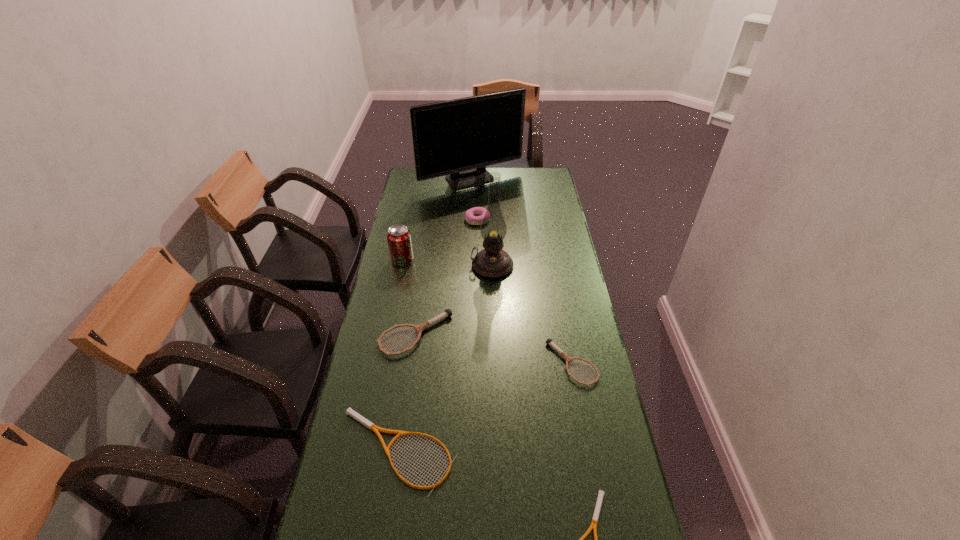
Locate an element on the screen. computer monitor is located at coordinates pos(458,138).

Find the location of a particular element. oil lamp is located at coordinates pos(492,262).

In order to click on soda can in this screenshot , I will do `click(399, 240)`.

In order to click on the second farthest object in this screenshot , I will do `click(474, 216)`.

The image size is (960, 540). What are the coordinates of `the fifth shortest object` in the screenshot? It's located at (474, 216).

Where is `the bigger gray tennis racket`? The image size is (960, 540). the bigger gray tennis racket is located at coordinates (419, 328).

Locate an element on the screen. This screenshot has height=540, width=960. the tallest tennis racket is located at coordinates pos(419,328).

Find the location of a particular element. The image size is (960, 540). the right gray tennis racket is located at coordinates (549, 341).

This screenshot has height=540, width=960. Identify the location of the third shortest object. (549, 341).

At what (x,y) coordinates should I click in order to perform the action: click on the left beige tennis racket. Please return your answer as a coordinate pair (x, y). Looking at the image, I should click on (349, 411).